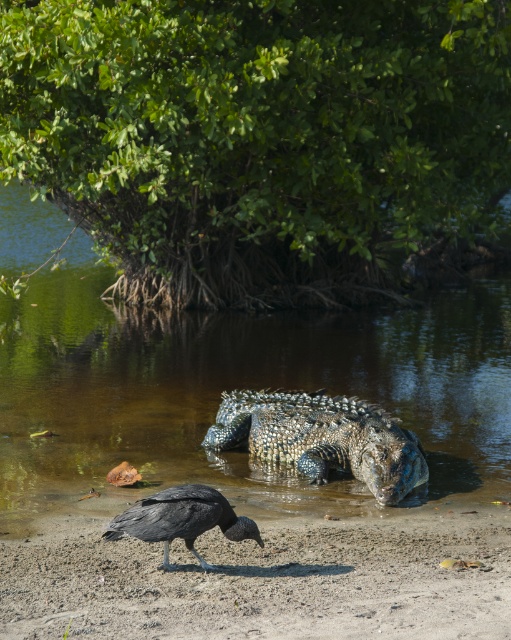
Between black matte bird at lower left and shiny black bird at lower center, which one appears on the right side from the viewer's perspective?

black matte bird at lower left is more to the right.

Is point (450, 572) more distant than point (195, 536)?

Yes, it is.

Locate an element on the screen. The height and width of the screenshot is (640, 511). black matte bird at lower left is located at coordinates (266, 580).

Between black matte bird at lower left and shiny scaly crocodile at center, which one appears on the right side from the viewer's perspective?

From the viewer's perspective, shiny scaly crocodile at center appears more on the right side.

Image resolution: width=511 pixels, height=640 pixels. Find the location of `black matte bird at lower left`. black matte bird at lower left is located at coordinates (266, 580).

Is point (110, 310) closer to camera compared to point (177, 532)?

No, it is behind (177, 532).

Is clear water at center taller than shiny black bird at lower center?

Yes.

The image size is (511, 640). In order to click on clear water at center in this screenshot , I will do `click(238, 387)`.

Where is `clear water at center`? clear water at center is located at coordinates (238, 387).